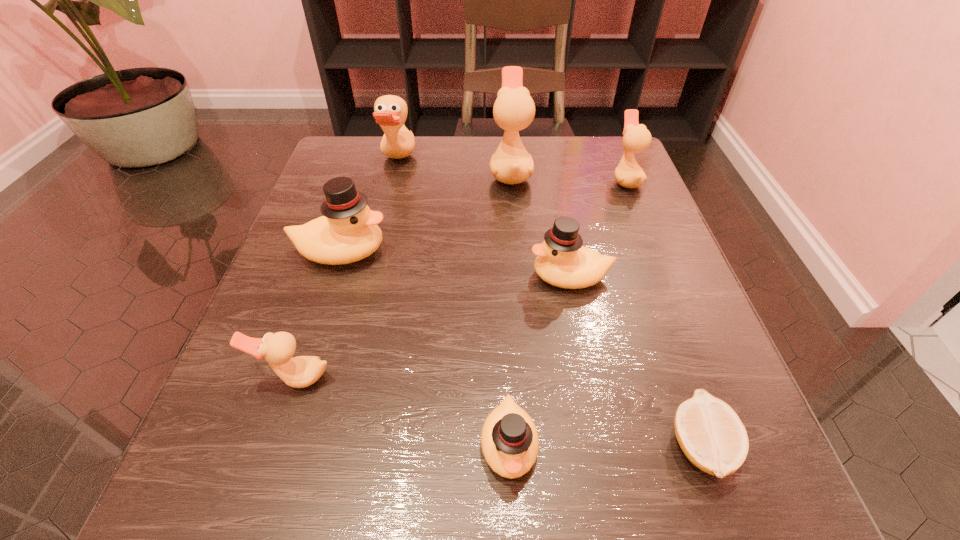
The width and height of the screenshot is (960, 540). What are the coordinates of `blank space located on the beak of the rightmost tan duck` in the screenshot? It's located at (552, 180).

Identify the location of vacant space located on the front-facing side of the rightmost yellow duck. The width and height of the screenshot is (960, 540). (357, 276).

The height and width of the screenshot is (540, 960). I want to click on vacant region located on the front-facing side of the rightmost yellow duck, so click(305, 276).

At what (x,y) coordinates should I click in order to perform the action: click on free space located 0.170m on the front-facing side of the rightmost yellow duck. Please return your answer as a coordinate pair (x, y). This screenshot has width=960, height=540. Looking at the image, I should click on click(432, 276).

Locate an element on the screen. This screenshot has height=540, width=960. blank space located 0.160m on the beak of the third nearest object is located at coordinates (249, 519).

Find the location of a particular element. The image size is (960, 540). free location located 0.340m on the back of the lemon is located at coordinates (628, 240).

The height and width of the screenshot is (540, 960). Identify the location of duck that is at the near edge. (509, 439).

The height and width of the screenshot is (540, 960). What are the coordinates of `lemon that is at the near edge` in the screenshot? It's located at (711, 435).

Identify the location of lemon present at the right edge. (711, 435).

You are a GUI agent. You are given a task and a screenshot of the screen. Output one action in this format:
    pyautogui.click(x=<x>, y=<y>)
    Task: Click on the object at the far left corner
    
    Given the screenshot: What is the action you would take?
    (390, 112)